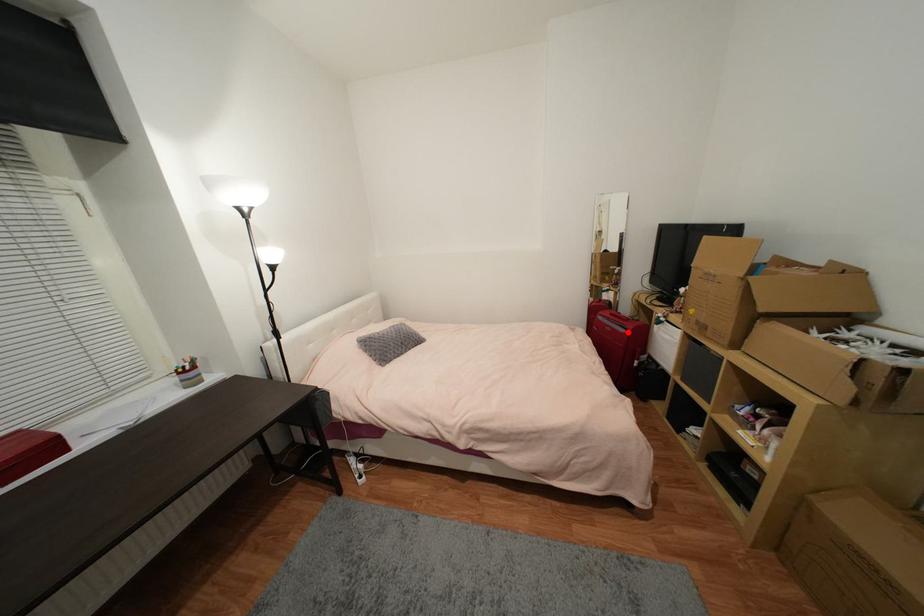
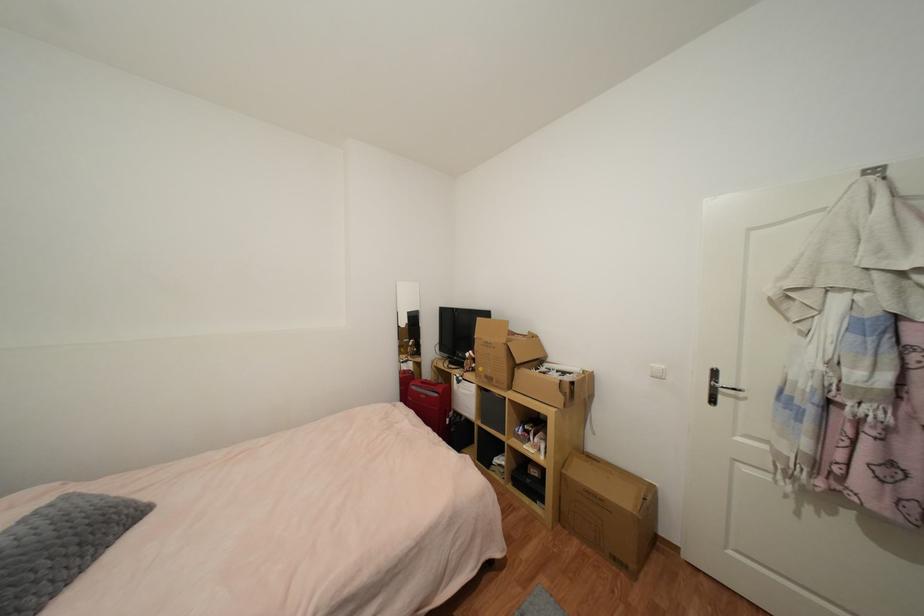
Find the pixel in the second image that matches the highlighted location in the first image.

(440, 397)